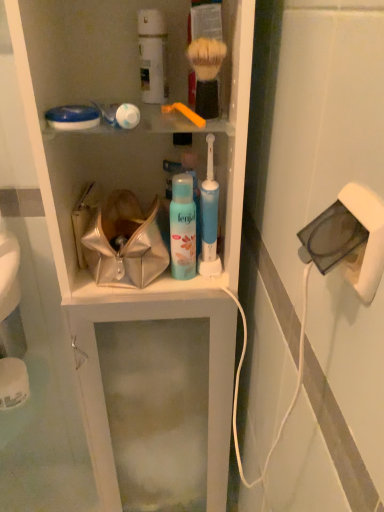
Question: Should I look upward or downward to see blue plastic toothbrush at center, which is counted as the second toiletry, starting from the top?

Choices:
 (A) up
 (B) down

Answer: (A)

Question: Considering the relative positions of metallic shiny handbag at center and blue plastic toothbrush at center, arranged as the 1th toiletry when viewed from the right, in the image provided, is metallic shiny handbag at center in front of blue plastic toothbrush at center, arranged as the 1th toiletry when viewed from the right,?

Choices:
 (A) yes
 (B) no

Answer: (B)

Question: Can we say metallic shiny handbag at center lies outside blue plastic toothbrush at center, which is counted as the second toiletry, starting from the top?

Choices:
 (A) no
 (B) yes

Answer: (B)

Question: Is metallic shiny handbag at center positioned with its back to blue plastic toothbrush at center, which is counted as the 2th toiletry, starting from the left?

Choices:
 (A) yes
 (B) no

Answer: (B)

Question: Is metallic shiny handbag at center positioned far away from blue plastic toothbrush at center, arranged as the 1th toiletry when viewed from the right?

Choices:
 (A) no
 (B) yes

Answer: (A)

Question: Considering the relative positions of metallic shiny handbag at center and blue plastic toothbrush at center, arranged as the 1th toiletry when viewed from the right, in the image provided, is metallic shiny handbag at center to the left of blue plastic toothbrush at center, arranged as the 1th toiletry when viewed from the right, from the viewer's perspective?

Choices:
 (A) yes
 (B) no

Answer: (A)

Question: Could you tell me if metallic shiny handbag at center is facing blue plastic toothbrush at center, arranged as the 1th toiletry when viewed from the right?

Choices:
 (A) no
 (B) yes

Answer: (A)

Question: Is yellow plastic toothbrush at upper center, the 2th brush in the right-to-left sequence, facing towards white plastic cabinet at center?

Choices:
 (A) yes
 (B) no

Answer: (A)

Question: From a real-world perspective, is yellow plastic toothbrush at upper center, the 2th brush in the right-to-left sequence, physically above white plastic cabinet at center?

Choices:
 (A) yes
 (B) no

Answer: (A)

Question: From the image's perspective, is yellow plastic toothbrush at upper center, the 2th brush in the right-to-left sequence, above white plastic cabinet at center?

Choices:
 (A) no
 (B) yes

Answer: (B)

Question: Is yellow plastic toothbrush at upper center, the 2th brush in the right-to-left sequence, located outside white plastic cabinet at center?

Choices:
 (A) no
 (B) yes

Answer: (A)

Question: Is yellow plastic toothbrush at upper center, the 1th brush positioned from the left, further to camera compared to white plastic cabinet at center?

Choices:
 (A) yes
 (B) no

Answer: (A)

Question: Is white plastic cabinet at center at the back of yellow plastic toothbrush at upper center, the 2th brush in the right-to-left sequence?

Choices:
 (A) no
 (B) yes

Answer: (B)

Question: Considering the relative sizes of white plastic cabinet at center and white matte canister at upper center, positioned as the first toiletry in top-to-bottom order, in the image provided, is white plastic cabinet at center smaller than white matte canister at upper center, positioned as the first toiletry in top-to-bottom order,?

Choices:
 (A) no
 (B) yes

Answer: (A)